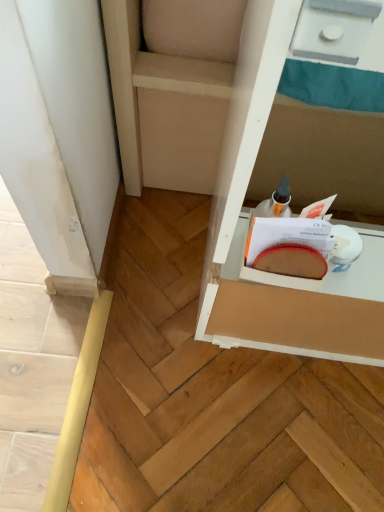
The height and width of the screenshot is (512, 384). I want to click on white cardboard drawer at lower right, so click(x=248, y=230).

The width and height of the screenshot is (384, 512). Describe the element at coordinates (248, 230) in the screenshot. I see `white cardboard drawer at lower right` at that location.

In order to click on white cardboard drawer at lower right in this screenshot , I will do `click(248, 230)`.